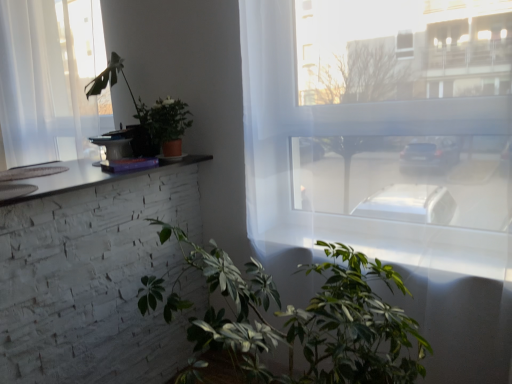
Question: Can you confirm if matte brown pot at upper center, the 2th houseplant in the bottom-to-top sequence, is wider than clear glass window at upper left, positioned as the 1th window in left-to-right order?

Choices:
 (A) yes
 (B) no

Answer: (B)

Question: From the image's perspective, is matte brown pot at upper center, the 2th houseplant in the bottom-to-top sequence, on clear glass window at upper left, which is the second window in front-to-back order?

Choices:
 (A) yes
 (B) no

Answer: (B)

Question: Does matte brown pot at upper center, the 2th houseplant in the bottom-to-top sequence, appear on the right side of clear glass window at upper left, marked as the 1th window in a back-to-front arrangement?

Choices:
 (A) no
 (B) yes

Answer: (B)

Question: Can you confirm if matte brown pot at upper center, the second houseplant when ordered from top to bottom, is thinner than clear glass window at upper left, positioned as the 1th window in left-to-right order?

Choices:
 (A) yes
 (B) no

Answer: (A)

Question: Would you say matte brown pot at upper center, the 2th houseplant in the bottom-to-top sequence, is outside clear glass window at upper left, marked as the 1th window in a back-to-front arrangement?

Choices:
 (A) yes
 (B) no

Answer: (A)

Question: Is matte brown pot at upper center, the second houseplant when ordered from top to bottom, to the left of clear glass window at upper left, which is the second window in front-to-back order, from the viewer's perspective?

Choices:
 (A) no
 (B) yes

Answer: (A)

Question: Is green matte plant at upper left, which is the 1th houseplant from top to bottom, smaller than green matte plant at lower center, positioned as the third houseplant in top-to-bottom order?

Choices:
 (A) no
 (B) yes

Answer: (B)

Question: Is green matte plant at upper left, which is the 1th houseplant from top to bottom, closer to the viewer compared to green matte plant at lower center, positioned as the first houseplant in bottom-to-top order?

Choices:
 (A) yes
 (B) no

Answer: (B)

Question: Is green matte plant at upper left, which is counted as the 3th houseplant, starting from the bottom, positioned far away from green matte plant at lower center, positioned as the third houseplant in top-to-bottom order?

Choices:
 (A) yes
 (B) no

Answer: (B)

Question: Considering the relative sizes of green matte plant at upper left, which is counted as the 3th houseplant, starting from the bottom, and green matte plant at lower center, positioned as the third houseplant in top-to-bottom order, in the image provided, is green matte plant at upper left, which is counted as the 3th houseplant, starting from the bottom, thinner than green matte plant at lower center, positioned as the third houseplant in top-to-bottom order,?

Choices:
 (A) yes
 (B) no

Answer: (A)

Question: Considering the relative positions of green matte plant at upper left, which is counted as the 3th houseplant, starting from the bottom, and green matte plant at lower center, positioned as the third houseplant in top-to-bottom order, in the image provided, is green matte plant at upper left, which is counted as the 3th houseplant, starting from the bottom, to the left of green matte plant at lower center, positioned as the third houseplant in top-to-bottom order, from the viewer's perspective?

Choices:
 (A) yes
 (B) no

Answer: (A)

Question: From the image's perspective, is green matte plant at upper left, which is the 1th houseplant from top to bottom, beneath green matte plant at lower center, positioned as the first houseplant in bottom-to-top order?

Choices:
 (A) yes
 (B) no

Answer: (B)

Question: Does matte brown pot at upper center, the second houseplant when ordered from top to bottom, lie behind green matte plant at upper left, which is the 1th houseplant from top to bottom?

Choices:
 (A) yes
 (B) no

Answer: (B)